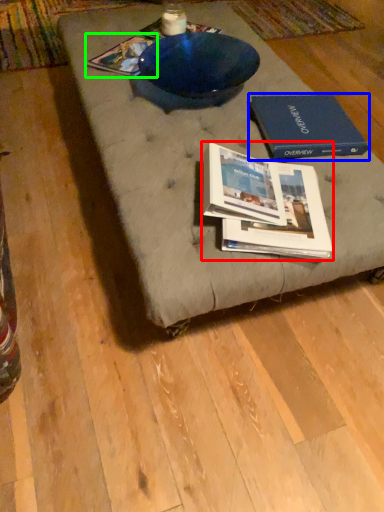
Question: Which is nearer to the book (highlighted by a red box)? paperback book (highlighted by a blue box) or book (highlighted by a green box).

Choices:
 (A) paperback book
 (B) book

Answer: (A)